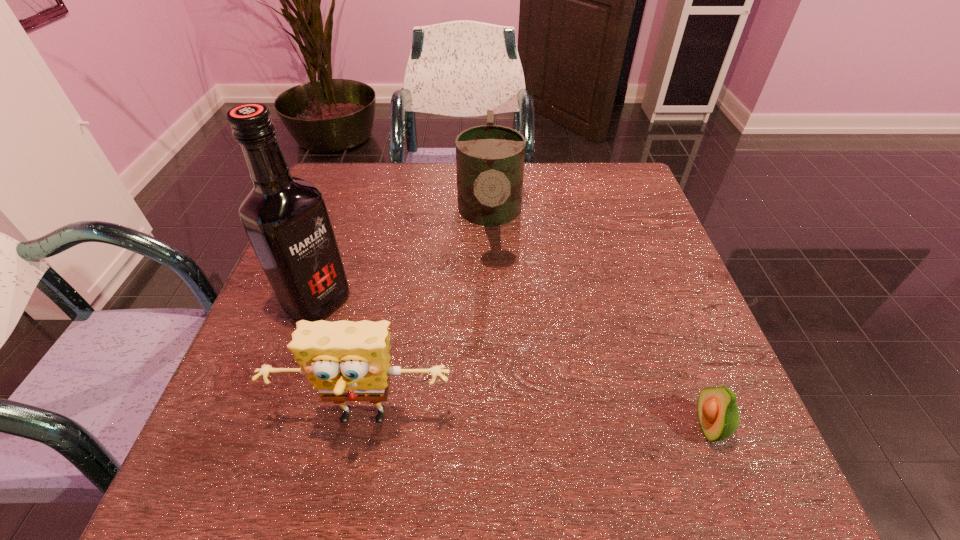
Identify the location of sponge. The image size is (960, 540). (346, 361).

Find the location of a particular element. Image resolution: width=960 pixels, height=540 pixels. avocado is located at coordinates (718, 413).

Where is `the shortest object`? The image size is (960, 540). the shortest object is located at coordinates (718, 413).

Where is `the second farthest object`? This screenshot has height=540, width=960. the second farthest object is located at coordinates (286, 219).

At what (x,y) coordinates should I click in order to perform the action: click on the tallest object. Please return your answer as a coordinate pair (x, y). This screenshot has height=540, width=960. Looking at the image, I should click on (286, 219).

Find the location of a particular element. The width and height of the screenshot is (960, 540). watering can is located at coordinates point(490,158).

Where is `free space located 0.250m on the cut side of the avocado`? free space located 0.250m on the cut side of the avocado is located at coordinates (544, 426).

Find the location of a particular element. vacant space located 0.050m on the cut side of the avocado is located at coordinates (663, 426).

The height and width of the screenshot is (540, 960). I want to click on free point located 0.080m on the cut side of the avocado, so click(646, 426).

Identify the location of free space located 0.130m on the front-facing side of the second farthest object. The width and height of the screenshot is (960, 540). (388, 343).